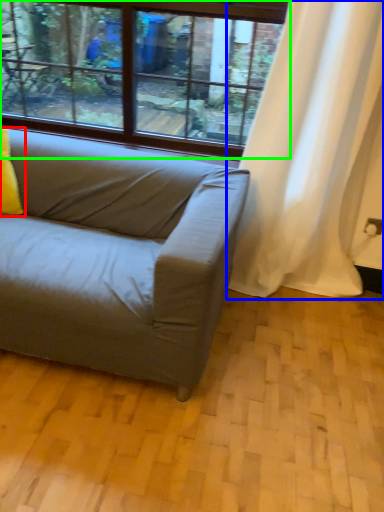
Question: Estimate the real-world distances between objects in this image. Which object is farther from pillow (highlighted by a red box), curtain (highlighted by a blue box) or window (highlighted by a green box)?

Choices:
 (A) curtain
 (B) window

Answer: (A)